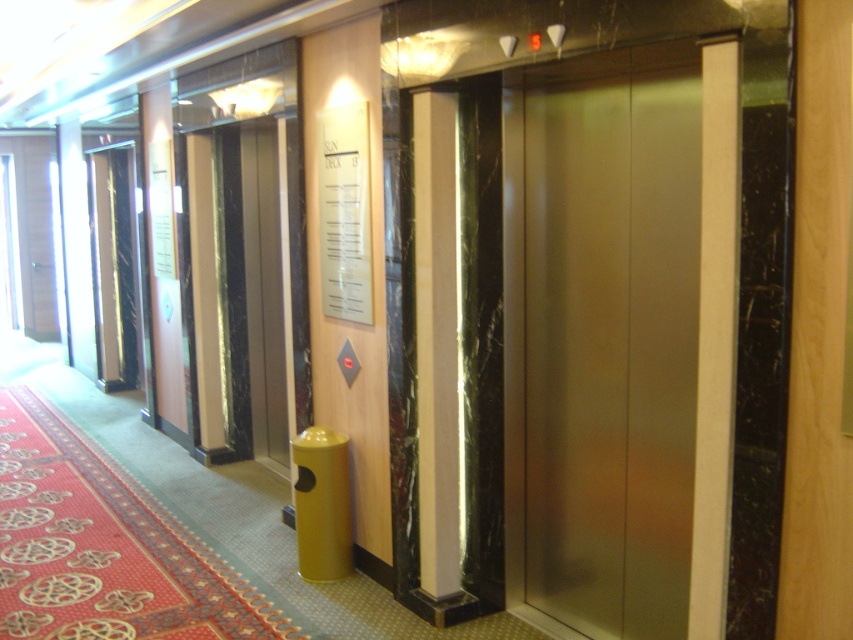
Question: Among these points, which one is farthest from the camera?

Choices:
 (A) (421, 300)
 (B) (670, 467)

Answer: (A)

Question: Is satin gold elevator at center closer to camera compared to white marble pillar at center?

Choices:
 (A) yes
 (B) no

Answer: (A)

Question: Which object appears farthest from the camera in this image?

Choices:
 (A) satin gold elevator at center
 (B) white marble pillar at center

Answer: (B)

Question: Can you confirm if satin gold elevator at center is smaller than white marble pillar at center?

Choices:
 (A) no
 (B) yes

Answer: (A)

Question: Can you confirm if satin gold elevator at center is thinner than white marble pillar at center?

Choices:
 (A) no
 (B) yes

Answer: (A)